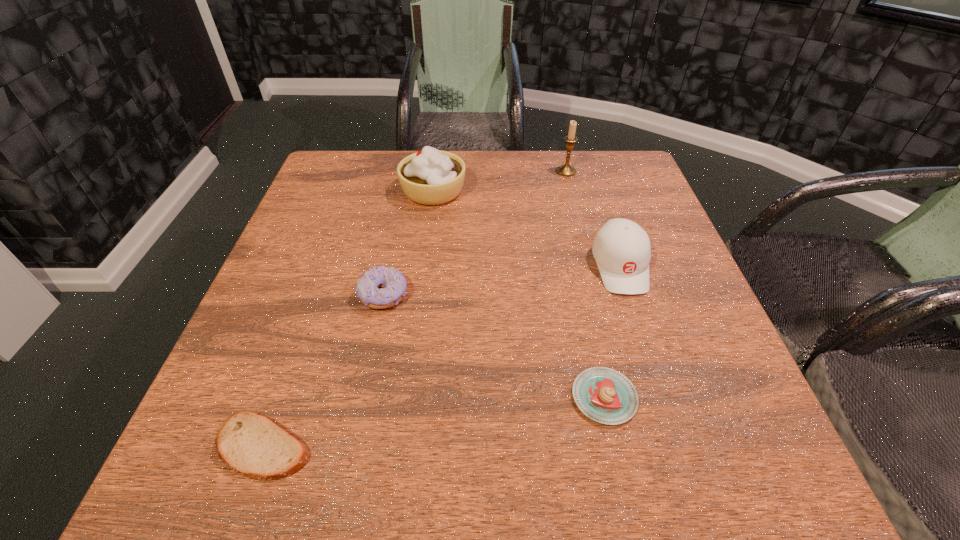
Locate an element on the screen. The height and width of the screenshot is (540, 960). candle holder is located at coordinates (566, 170).

Find the location of a particular element. Image resolution: width=960 pixels, height=540 pixels. the second tallest object is located at coordinates (430, 177).

Image resolution: width=960 pixels, height=540 pixels. Identify the location of the third tallest object. (621, 248).

Locate an element on the screen. This screenshot has height=540, width=960. doughnut is located at coordinates (392, 283).

The image size is (960, 540). I want to click on the second shortest object, so click(604, 395).

Locate an element on the screen. Image resolution: width=960 pixels, height=540 pixels. the shortest object is located at coordinates (250, 444).

This screenshot has height=540, width=960. I want to click on the leftmost object, so click(x=250, y=444).

Find the location of a particular element. This screenshot has height=540, width=960. free location located on the left of the candle holder is located at coordinates (438, 171).

Where is `free space located 0.090m on the left of the fifth shortest object`? The width and height of the screenshot is (960, 540). free space located 0.090m on the left of the fifth shortest object is located at coordinates [366, 191].

The image size is (960, 540). Find the location of `free space located 0.080m on the front-facing side of the baseball cap`. free space located 0.080m on the front-facing side of the baseball cap is located at coordinates (640, 329).